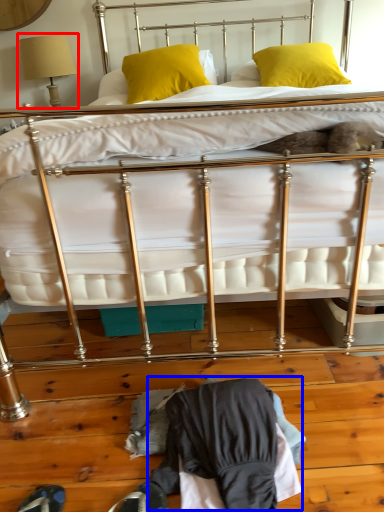
Question: Among these objects, which one is nearest to the camera, table lamp (highlighted by a red box) or clothing (highlighted by a blue box)?

Choices:
 (A) table lamp
 (B) clothing

Answer: (B)